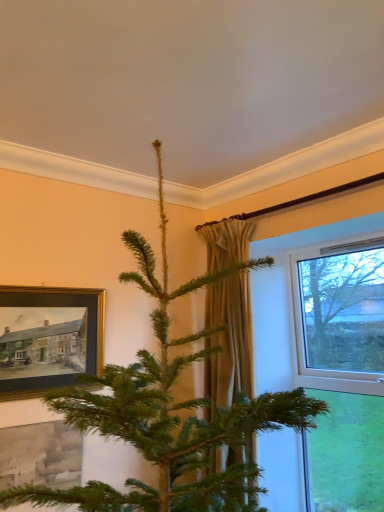
Describe the element at coordinates (342, 370) in the screenshot. The height and width of the screenshot is (512, 384). I see `clear glass window at right` at that location.

I want to click on clear glass window at right, so click(x=342, y=370).

Considering the relative sizes of beige fabric curtain at center and green matte christmas tree at center in the image provided, is beige fabric curtain at center wider than green matte christmas tree at center?

No, beige fabric curtain at center is not wider than green matte christmas tree at center.

Consider the image. Considering the sizes of beige fabric curtain at center and green matte christmas tree at center in the image, is beige fabric curtain at center bigger or smaller than green matte christmas tree at center?

In the image, beige fabric curtain at center appears to be smaller than green matte christmas tree at center.

Can you confirm if beige fabric curtain at center is positioned to the right of green matte christmas tree at center?

Yes.

How many degrees apart are the facing directions of beige fabric curtain at center and green matte christmas tree at center?

0.00405 degrees.

From a real-world perspective, relative to green matte christmas tree at center, is gold-framed painting at left vertically above or below?

In terms of real-world spatial position, gold-framed painting at left is above green matte christmas tree at center.

Is gold-framed painting at left oriented away from green matte christmas tree at center?

gold-framed painting at left is not turned away from green matte christmas tree at center.

Is gold-framed painting at left far away from green matte christmas tree at center?

That's not correct — gold-framed painting at left is a little close to green matte christmas tree at center.

Consider the image. From the image's perspective, which is below, gold-framed painting at left or clear glass window at right?

clear glass window at right.

Based on the photo, can you see gold-framed painting at left touching clear glass window at right?

No, gold-framed painting at left is not making contact with clear glass window at right.

Can you confirm if gold-framed painting at left is wider than clear glass window at right?

In fact, gold-framed painting at left might be narrower than clear glass window at right.

From the image's perspective, which is below, beige fabric curtain at center or clear glass window at right?

From the image's view, clear glass window at right is below.

You are a GUI agent. You are given a task and a screenshot of the screen. Output one action in this format:
    pyautogui.click(x=<x>, y=<y>)
    Task: Click on the curtain that is above the clear glass window at right (from the image's perspective)
    The width and height of the screenshot is (384, 512).
    Given the screenshot: What is the action you would take?
    click(x=229, y=341)

Is point (317, 372) closer to viewer compared to point (180, 291)?

No, it is behind (180, 291).

This screenshot has height=512, width=384. What are the coordinates of `christmas tree to the left of clear glass window at right` in the screenshot? It's located at (171, 410).

Which object is closer to the camera, clear glass window at right or green matte christmas tree at center?

green matte christmas tree at center is more forward.

Is green matte christmas tree at center shorter than beige fabric curtain at center?

No.

Would you say green matte christmas tree at center is a long distance from beige fabric curtain at center?

That's not correct — green matte christmas tree at center is a little close to beige fabric curtain at center.

Between green matte christmas tree at center and beige fabric curtain at center, which one has smaller size?

beige fabric curtain at center is smaller.

Which object is thinner, green matte christmas tree at center or beige fabric curtain at center?

Thinner between the two is beige fabric curtain at center.

Is green matte christmas tree at center taller or shorter than gold-framed painting at left?

In the image, green matte christmas tree at center appears to be taller than gold-framed painting at left.

Can you confirm if green matte christmas tree at center is smaller than gold-framed painting at left?

No.

Is green matte christmas tree at center wider or thinner than gold-framed painting at left?

In the image, green matte christmas tree at center appears to be wider than gold-framed painting at left.

In the scene shown: Is gold-framed painting at left a part of green matte christmas tree at center?

No, green matte christmas tree at center does not contain gold-framed painting at left.

Locate an element on the screen. The height and width of the screenshot is (512, 384). curtain below the green matte christmas tree at center (from a real-world perspective) is located at coordinates (229, 341).

Identify the location of christmas tree on the right of gold-framed painting at left. (171, 410).

Looking at the image, which one is located closer to gold-framed painting at left, beige fabric curtain at center or clear glass window at right?

Based on the image, beige fabric curtain at center appears to be nearer to gold-framed painting at left.

When comparing their distances from beige fabric curtain at center, does clear glass window at right or green matte christmas tree at center seem closer?

green matte christmas tree at center lies closer to beige fabric curtain at center than the other object.

Which object lies further to the anchor point clear glass window at right, gold-framed painting at left or beige fabric curtain at center?

gold-framed painting at left is further to clear glass window at right.

Based on their spatial positions, is clear glass window at right or green matte christmas tree at center further from gold-framed painting at left?

clear glass window at right.

Which object lies further to the anchor point gold-framed painting at left, clear glass window at right or beige fabric curtain at center?

Among the two, clear glass window at right is located further to gold-framed painting at left.

Which object lies further to the anchor point clear glass window at right, green matte christmas tree at center or beige fabric curtain at center?

The object further to clear glass window at right is green matte christmas tree at center.

From the image, which object appears to be farther from beige fabric curtain at center, gold-framed painting at left or clear glass window at right?

clear glass window at right lies further to beige fabric curtain at center than the other object.

Which object lies further to the anchor point gold-framed painting at left, green matte christmas tree at center or beige fabric curtain at center?

beige fabric curtain at center is further to gold-framed painting at left.

You are a GUI agent. You are given a task and a screenshot of the screen. Output one action in this format:
    pyautogui.click(x=<x>, y=<y>)
    Task: Click on the window between green matte christmas tree at center and beige fabric curtain at center along the z-axis
    
    Given the screenshot: What is the action you would take?
    click(342, 370)

Image resolution: width=384 pixels, height=512 pixels. I want to click on picture frame between green matte christmas tree at center and beige fabric curtain at center in the front-back direction, so (48, 338).

In order to click on window positioned between green matte christmas tree at center and gold-framed painting at left from near to far in this screenshot , I will do `click(342, 370)`.

The height and width of the screenshot is (512, 384). In order to click on curtain located between gold-framed painting at left and clear glass window at right in the left-right direction in this screenshot , I will do `click(229, 341)`.